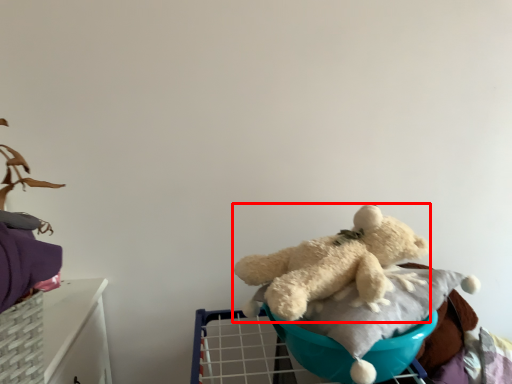
Question: Where is teddy bear (annotated by the red box) located in relation to baby carriage in the image?

Choices:
 (A) left
 (B) right

Answer: (A)